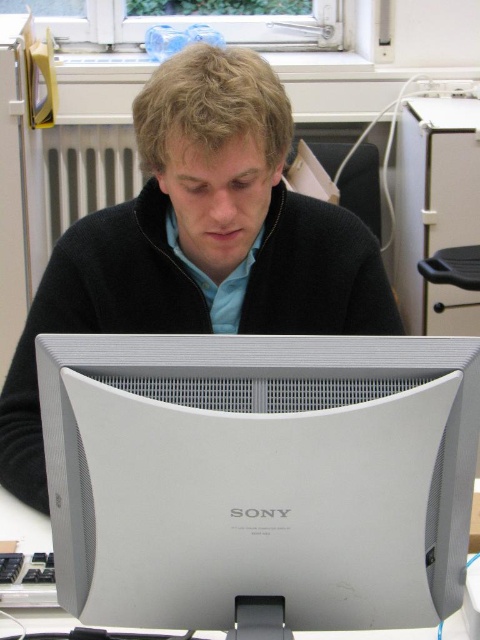
You are a photographer taking a picture of the scene. You want to focus on the point at the bottom left corner of the frame. Which of the two points, point [251,547] or point [298,326], is closer to the camera and should be in focus?

Point [251,547] is closer to the camera than point [298,326], so it should be in focus.

Based on the scene description, can you determine the spatial relationship between the satin silver monitor at center and the black matte sweater at center?

The satin silver monitor at center is to the right of the black matte sweater at center.